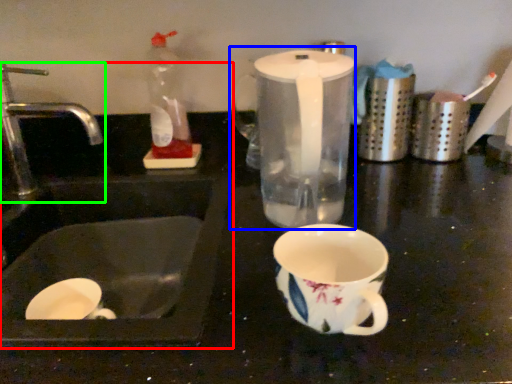
Question: Based on their relative distances, which object is nearer to sink (highlighted by a red box)? Choose from blender (highlighted by a blue box) and tap (highlighted by a green box).

Choices:
 (A) blender
 (B) tap

Answer: (B)